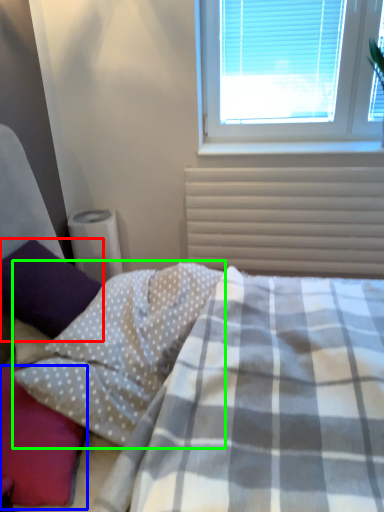
Question: Which object is positioned closest to pillow (highlighted by a red box)? Select from pillow (highlighted by a blue box) and pillow (highlighted by a green box).

Choices:
 (A) pillow
 (B) pillow

Answer: (B)